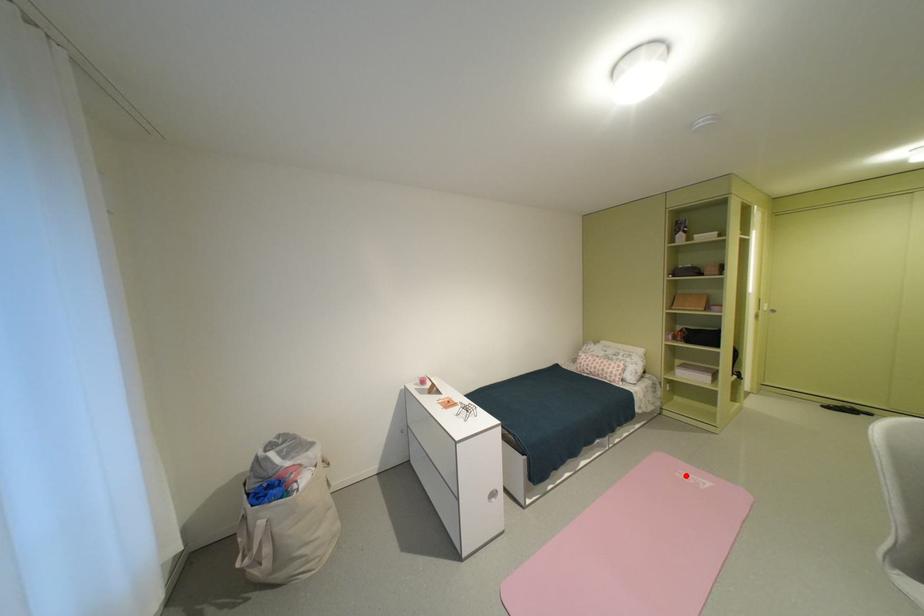
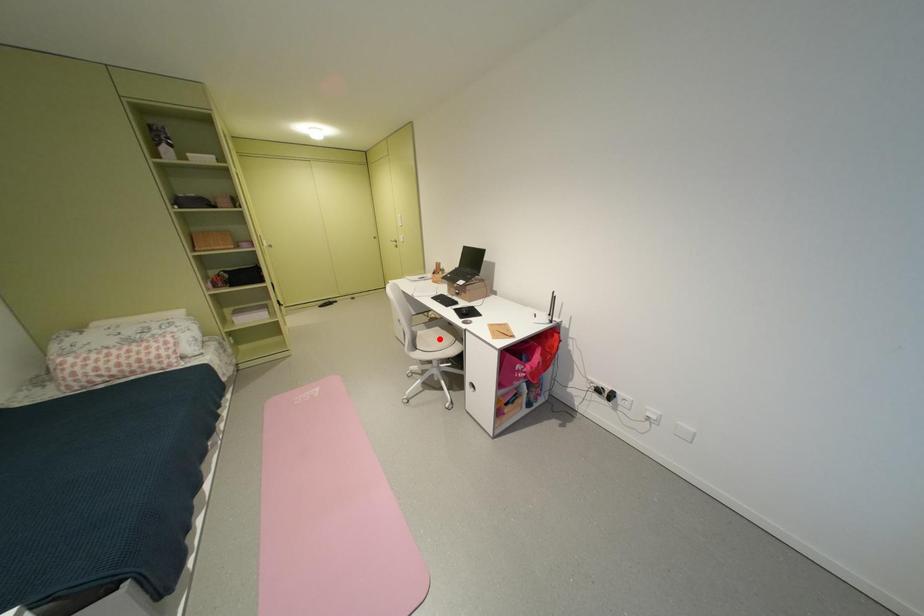
I am providing you with two images of the same scene from different viewpoints. A red point is marked on the first image and another point is marked on the second image. Are the points marked in image1 and image2 representing the same 3D position?

No